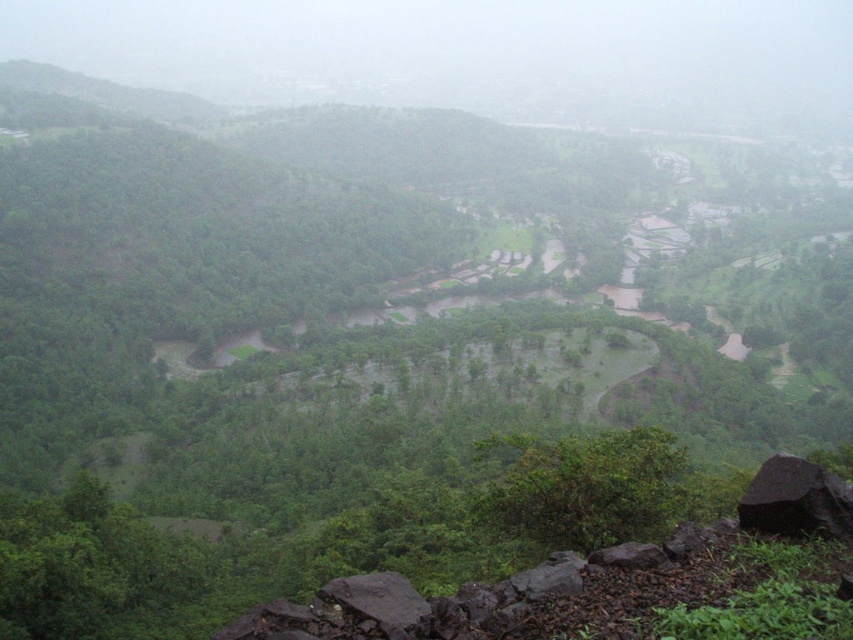
You are a hiker standing at the elevated viewpoint and want to determine the relative positions of two points marked in the landscape. Which point is closer to you, the observer, point at coordinate (x=830, y=529) or point at coordinate (x=381, y=624)?

→ Point at coordinate (x=830, y=529) is closer to you than point at coordinate (x=381, y=624) because it is further to the viewer according to the description.

You are standing at the top of a hill overlooking the landscape. You see the black rock at lower right and the dark gray rock at lower center. Which rock is positioned more to the east if you are facing the scene?

The black rock at lower right is positioned to the right of the dark gray rock at lower center, so if you are facing the scene, the black rock at lower right would be more to the east.

You are standing at the top of the hill overlooking the landscape. You see the black rock at lower right and the dark gray rock at lower center. Which rock is positioned higher from your viewpoint?

The black rock at lower right is positioned higher than the dark gray rock at lower center because it is above it from your viewpoint.